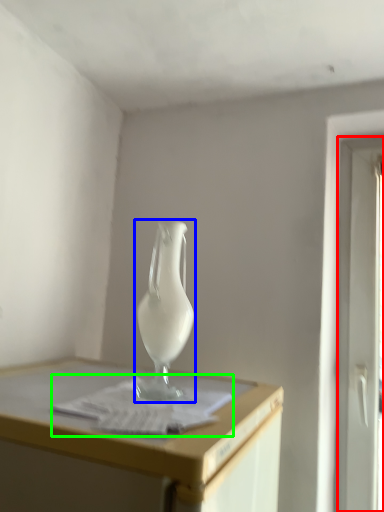
Question: Considering the real-world distances, which object is closest to screen door (highlighted by a red box)? vase (highlighted by a blue box) or paper (highlighted by a green box).

Choices:
 (A) vase
 (B) paper

Answer: (A)